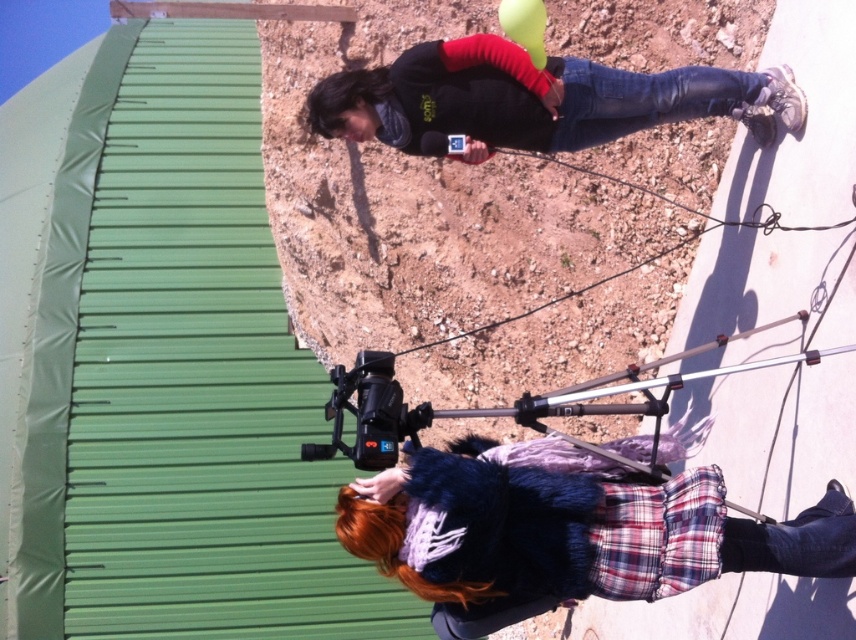
Based on the photo, who is positioned more to the left, fluffy blue coat at lower center or metallic silver tripod at center?

metallic silver tripod at center is more to the left.

Is fluffy blue coat at lower center taller than metallic silver tripod at center?

No, fluffy blue coat at lower center is not taller than metallic silver tripod at center.

You are a GUI agent. You are given a task and a screenshot of the screen. Output one action in this format:
    pyautogui.click(x=<x>, y=<y>)
    Task: Click on the fluffy blue coat at lower center
    The image size is (856, 640).
    Given the screenshot: What is the action you would take?
    pyautogui.click(x=574, y=529)

At what (x,y) coordinates should I click in order to perform the action: click on fluffy blue coat at lower center. Please return your answer as a coordinate pair (x, y). Looking at the image, I should click on (574, 529).

Who is more distant from viewer, (698, 490) or (571, 144)?

The point (571, 144) is behind.

How far apart are fluffy blue coat at lower center and jeans at lower right?

A distance of 8.37 meters exists between fluffy blue coat at lower center and jeans at lower right.

Is point (581, 589) positioned behind point (752, 128)?

No, (581, 589) is closer to viewer.

The width and height of the screenshot is (856, 640). Find the location of `fluffy blue coat at lower center`. fluffy blue coat at lower center is located at coordinates (574, 529).

Which is more to the left, metallic silver tripod at center or black plastic video camera at center?

From the viewer's perspective, black plastic video camera at center appears more on the left side.

Can you confirm if metallic silver tripod at center is positioned above black plastic video camera at center?

Yes.

Image resolution: width=856 pixels, height=640 pixels. I want to click on metallic silver tripod at center, so click(x=491, y=406).